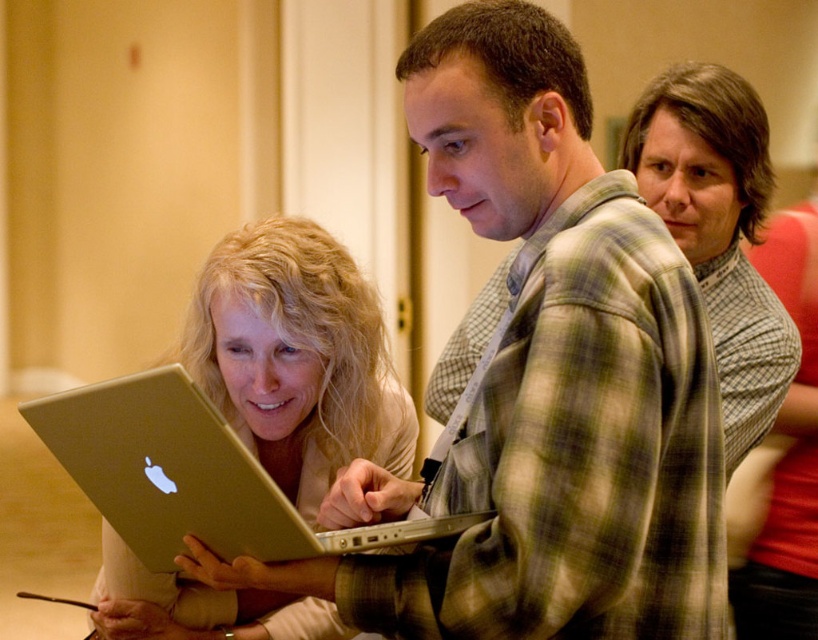
Question: Does matte gold laptop at center appear under silver metallic laptop at center?

Choices:
 (A) yes
 (B) no

Answer: (B)

Question: In this image, where is matte gold laptop at center located relative to silver metallic laptop at center?

Choices:
 (A) left
 (B) right

Answer: (A)

Question: Which of the following is the farthest from the observer?

Choices:
 (A) (136, 593)
 (B) (70, 458)

Answer: (A)

Question: Does matte gold laptop at center appear on the right side of silver metallic laptop at center?

Choices:
 (A) no
 (B) yes

Answer: (A)

Question: Which of the following is the farthest from the observer?

Choices:
 (A) matte gold laptop at center
 (B) silver metallic laptop at center

Answer: (A)